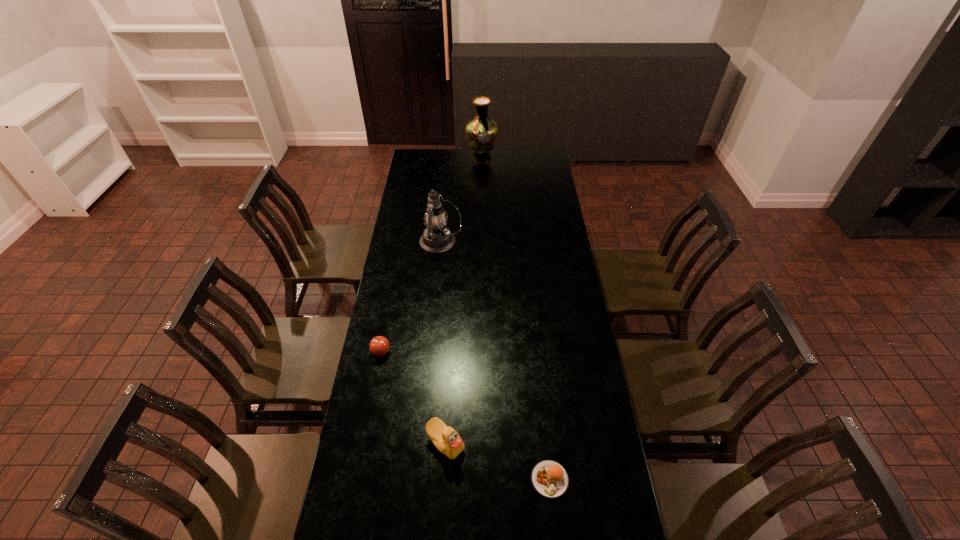
The height and width of the screenshot is (540, 960). I want to click on vacant area between the second farthest object and the farthest object, so click(x=461, y=200).

You are a GUI agent. You are given a task and a screenshot of the screen. Output one action in this format:
    pyautogui.click(x=<x>, y=<y>)
    Task: Click on the free space that is in between the tallest object and the third tallest object
    
    Given the screenshot: What is the action you would take?
    pyautogui.click(x=464, y=300)

What are the coordinates of `empty space between the second tallest object and the leftmost object` in the screenshot? It's located at (411, 296).

Locate which object is the third closest to the shortest object. Please provide its 2D coordinates. Your answer should be formatted as a tuple, i.e. [(x, y)], where the tuple contains the x and y coordinates of a point satisfying the conditions above.

[(437, 238)]

Identify the location of the third closest object to the rightmost object. Image resolution: width=960 pixels, height=540 pixels. (437, 238).

Image resolution: width=960 pixels, height=540 pixels. Find the location of `free region that satisfies the following two spatial constraints: 1. at the beak of the duck; 2. on the right side of the patty`. free region that satisfies the following two spatial constraints: 1. at the beak of the duck; 2. on the right side of the patty is located at coordinates (444, 480).

The width and height of the screenshot is (960, 540). Identify the location of vacant point that satisfies the following two spatial constraints: 1. at the beak of the shortest object; 2. on the right side of the third tallest object. (444, 480).